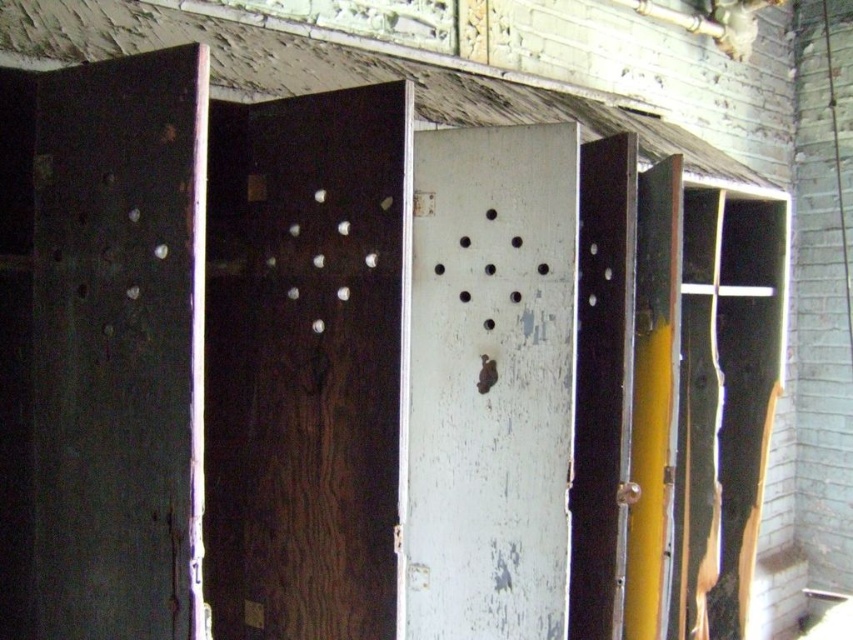
Question: Among these points, which one is farthest from the camera?

Choices:
 (A) (387, 225)
 (B) (448, 568)

Answer: (B)

Question: Is dark wood door at center above white peeling paint at center?

Choices:
 (A) no
 (B) yes

Answer: (B)

Question: Which of the following is the farthest from the observer?

Choices:
 (A) (479, 413)
 (B) (283, 596)

Answer: (A)

Question: Can you confirm if dark wood door at center is positioned above white peeling paint at center?

Choices:
 (A) no
 (B) yes

Answer: (B)

Question: Can you confirm if dark wood door at center is positioned below white peeling paint at center?

Choices:
 (A) yes
 (B) no

Answer: (B)